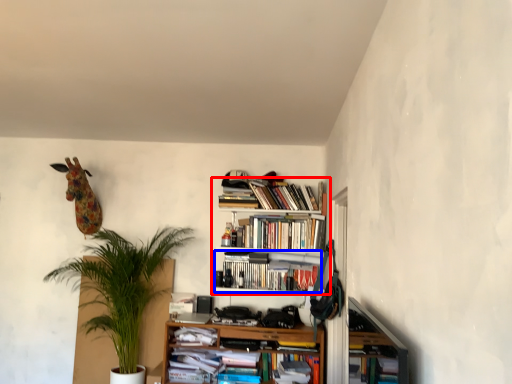
Question: Among these objects, which one is nearest to the camera, bookcase (highlighted by a red box) or book (highlighted by a blue box)?

Choices:
 (A) bookcase
 (B) book

Answer: (A)